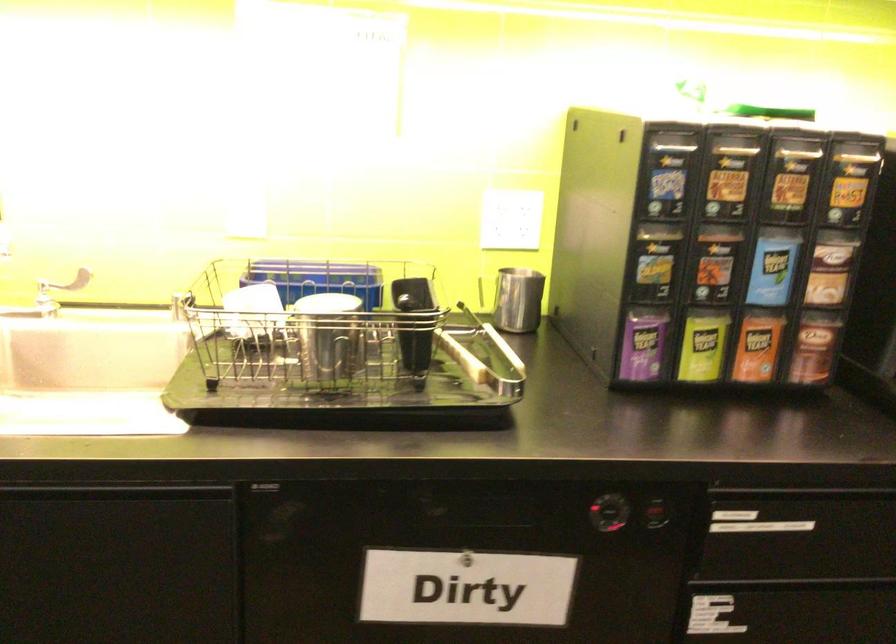
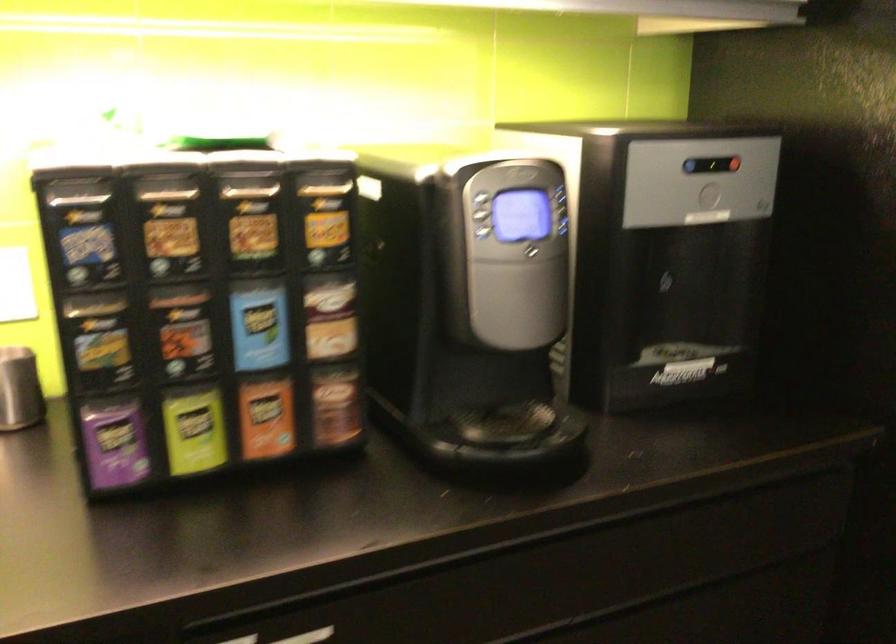
Find the pixel in the second image that matches pixel 772 269 in the first image.

(259, 327)